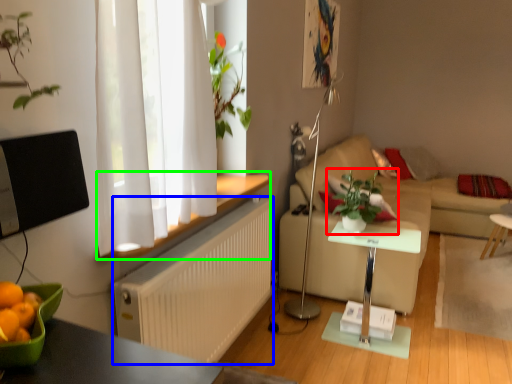
Question: Considering the real-world distances, which object is closest to houseplant (highlighted by a red box)? radiator (highlighted by a blue box) or window sill (highlighted by a green box).

Choices:
 (A) radiator
 (B) window sill

Answer: (B)